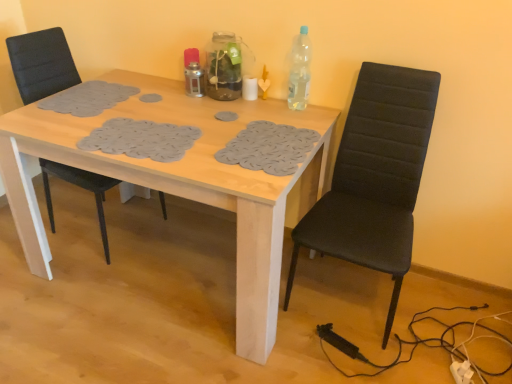
The width and height of the screenshot is (512, 384). What are the coordinates of `black fabric chair at right, the first chair from the right` in the screenshot? It's located at (375, 177).

Describe the element at coordinates (375, 177) in the screenshot. The width and height of the screenshot is (512, 384). I see `black fabric chair at right, the first chair from the right` at that location.

In order to click on black fabric chair at right, the first chair from the right in this screenshot , I will do `click(375, 177)`.

From a real-world perspective, is black fabric chair at right, the first chair from the right, positioned over black fabric chair at left, placed as the 2th chair when sorted from right to left, based on gravity?

Incorrect, from a real-world perspective, black fabric chair at right, the first chair from the right, is lower than black fabric chair at left, placed as the 2th chair when sorted from right to left.

How different are the orientations of black fabric chair at right, the first chair from the right, and black fabric chair at left, the 1th chair positioned from the left, in degrees?

The angle between the facing direction of black fabric chair at right, the first chair from the right, and the facing direction of black fabric chair at left, the 1th chair positioned from the left, is 86.2 degrees.

Considering the positions of points (385, 106) and (109, 261), is point (385, 106) farther from camera compared to point (109, 261)?

No, it is not.

Considering the relative sizes of black fabric chair at right, the first chair from the right, and black fabric chair at left, the 1th chair positioned from the left, in the image provided, is black fabric chair at right, the first chair from the right, smaller than black fabric chair at left, the 1th chair positioned from the left,?

Incorrect, black fabric chair at right, the first chair from the right, is not smaller in size than black fabric chair at left, the 1th chair positioned from the left.

Consider the image. Does light wood table at center turn towards clear plastic bottle at upper right?

No, light wood table at center is not aimed at clear plastic bottle at upper right.

From the picture: From the image's perspective, is light wood table at center above or below clear plastic bottle at upper right?

light wood table at center is below clear plastic bottle at upper right.

Can you confirm if light wood table at center is thinner than clear plastic bottle at upper right?

No, light wood table at center is not thinner than clear plastic bottle at upper right.

From their relative heights in the image, would you say black fabric chair at left, the 1th chair positioned from the left, is taller or shorter than clear plastic bottle at upper right?

black fabric chair at left, the 1th chair positioned from the left, is taller than clear plastic bottle at upper right.

Does black fabric chair at left, placed as the 2th chair when sorted from right to left, touch clear plastic bottle at upper right?

black fabric chair at left, placed as the 2th chair when sorted from right to left, and clear plastic bottle at upper right are clearly separated.

From the image's perspective, between black fabric chair at left, the 1th chair positioned from the left, and clear plastic bottle at upper right, which one is located above?

clear plastic bottle at upper right appears higher in the image.

Considering their positions, is light wood table at center located in front of or behind black fabric chair at left, placed as the 2th chair when sorted from right to left?

light wood table at center is positioned closer to the viewer than black fabric chair at left, placed as the 2th chair when sorted from right to left.

Is light wood table at center taller or shorter than black fabric chair at left, the 1th chair positioned from the left?

Considering their sizes, light wood table at center has less height than black fabric chair at left, the 1th chair positioned from the left.

Which point is more forward, [176,186] or [90,173]?

The point [176,186] is in front.

Can you confirm if light wood table at center is bigger than black fabric chair at left, placed as the 2th chair when sorted from right to left?

Yes, light wood table at center is bigger than black fabric chair at left, placed as the 2th chair when sorted from right to left.

Is black fabric chair at left, the 1th chair positioned from the left, touching light wood table at center?

No, black fabric chair at left, the 1th chair positioned from the left, is not next to light wood table at center.

Who is bigger, black fabric chair at left, the 1th chair positioned from the left, or light wood table at center?

With larger size is light wood table at center.

In the scene shown: Does black fabric chair at left, the 1th chair positioned from the left, have a lesser height compared to light wood table at center?

No.

Considering the positions of objects black fabric chair at left, the 1th chair positioned from the left, and light wood table at center in the image provided, who is behind, black fabric chair at left, the 1th chair positioned from the left, or light wood table at center?

black fabric chair at left, the 1th chair positioned from the left, is further from the camera.

From the image's perspective, which object appears higher, black fabric chair at right, the 2th chair viewed from the left, or clear plastic bottle at upper right?

clear plastic bottle at upper right.

Is black fabric chair at right, the first chair from the right, thinner than clear plastic bottle at upper right?

No, black fabric chair at right, the first chair from the right, is not thinner than clear plastic bottle at upper right.

Image resolution: width=512 pixels, height=384 pixels. I want to click on bottle above the black fabric chair at right, the first chair from the right (from the image's perspective), so click(298, 71).

Is clear plastic bottle at upper right at the left side of black fabric chair at right, the 2th chair viewed from the left?

Yes.

Is clear plastic bottle at upper right oriented away from black fabric chair at right, the first chair from the right?

clear plastic bottle at upper right does not have its back to black fabric chair at right, the first chair from the right.

Looking at this image, is clear plastic bottle at upper right not within black fabric chair at right, the first chair from the right?

Absolutely, clear plastic bottle at upper right is external to black fabric chair at right, the first chair from the right.

Is clear plastic bottle at upper right next to black fabric chair at right, the 2th chair viewed from the left, and touching it?

There is a gap between clear plastic bottle at upper right and black fabric chair at right, the 2th chair viewed from the left.

This screenshot has width=512, height=384. Identify the location of chair on the right of the black fabric chair at left, placed as the 2th chair when sorted from right to left. (375, 177).

The image size is (512, 384). What are the coordinates of `bottle located above the light wood table at center (from a real-world perspective)` in the screenshot? It's located at (298, 71).

When comparing their distances from clear plastic bottle at upper right, does black fabric chair at left, the 1th chair positioned from the left, or light wood table at center seem closer?

light wood table at center lies closer to clear plastic bottle at upper right than the other object.

Considering their positions, is clear plastic bottle at upper right positioned further to light wood table at center than black fabric chair at left, placed as the 2th chair when sorted from right to left?

Among the two, black fabric chair at left, placed as the 2th chair when sorted from right to left, is located further to light wood table at center.

Based on their spatial positions, is clear plastic bottle at upper right or light wood table at center further from black fabric chair at right, the first chair from the right?

clear plastic bottle at upper right is positioned further to the anchor black fabric chair at right, the first chair from the right.

Which object lies nearer to the anchor point black fabric chair at left, the 1th chair positioned from the left, black fabric chair at right, the 2th chair viewed from the left, or light wood table at center?

The object closer to black fabric chair at left, the 1th chair positioned from the left, is light wood table at center.

Based on their spatial positions, is black fabric chair at right, the first chair from the right, or black fabric chair at left, placed as the 2th chair when sorted from right to left, closer to light wood table at center?

black fabric chair at right, the first chair from the right, is positioned closer to the anchor light wood table at center.

Estimate the real-world distances between objects in this image. Which object is further from black fabric chair at left, the 1th chair positioned from the left, light wood table at center or black fabric chair at right, the first chair from the right?

black fabric chair at right, the first chair from the right, lies further to black fabric chair at left, the 1th chair positioned from the left, than the other object.

When comparing their distances from black fabric chair at right, the first chair from the right, does black fabric chair at left, the 1th chair positioned from the left, or clear plastic bottle at upper right seem closer?

clear plastic bottle at upper right is closer to black fabric chair at right, the first chair from the right.

From the image, which object appears to be nearer to light wood table at center, black fabric chair at left, the 1th chair positioned from the left, or black fabric chair at right, the first chair from the right?

The object closer to light wood table at center is black fabric chair at right, the first chair from the right.

Locate an element on the screen. The height and width of the screenshot is (384, 512). table between black fabric chair at left, the 1th chair positioned from the left, and clear plastic bottle at upper right is located at coordinates (179, 183).

Where is `table situated between black fabric chair at left, the 1th chair positioned from the left, and black fabric chair at right, the 2th chair viewed from the left, from left to right`? table situated between black fabric chair at left, the 1th chair positioned from the left, and black fabric chair at right, the 2th chair viewed from the left, from left to right is located at coordinates (179, 183).

The image size is (512, 384). What are the coordinates of `bottle between black fabric chair at left, placed as the 2th chair when sorted from right to left, and black fabric chair at right, the 2th chair viewed from the left, from left to right` in the screenshot? It's located at coord(298,71).

Where is `bottle between light wood table at center and black fabric chair at right, the 2th chair viewed from the left, in the horizontal direction`? The width and height of the screenshot is (512, 384). bottle between light wood table at center and black fabric chair at right, the 2th chair viewed from the left, in the horizontal direction is located at coordinates (298, 71).